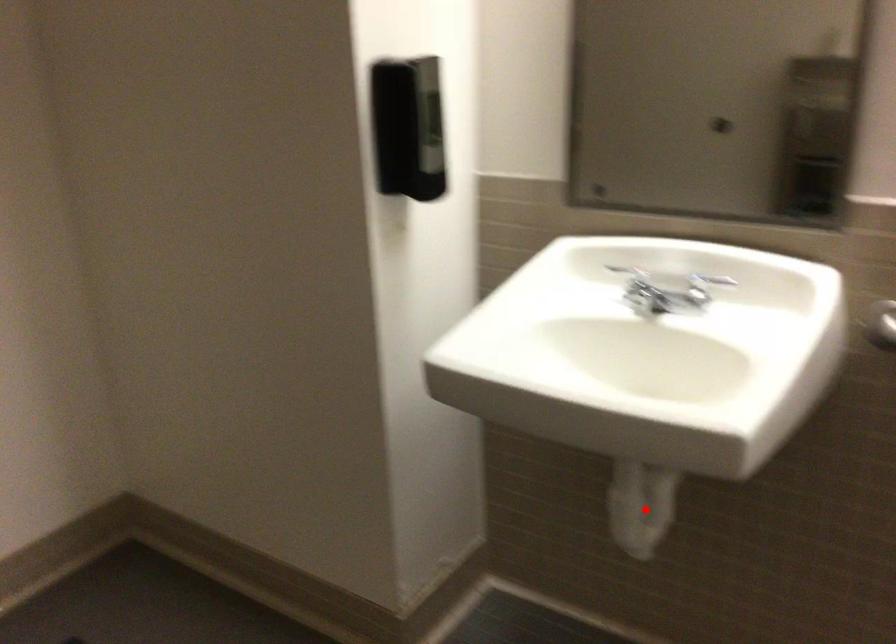
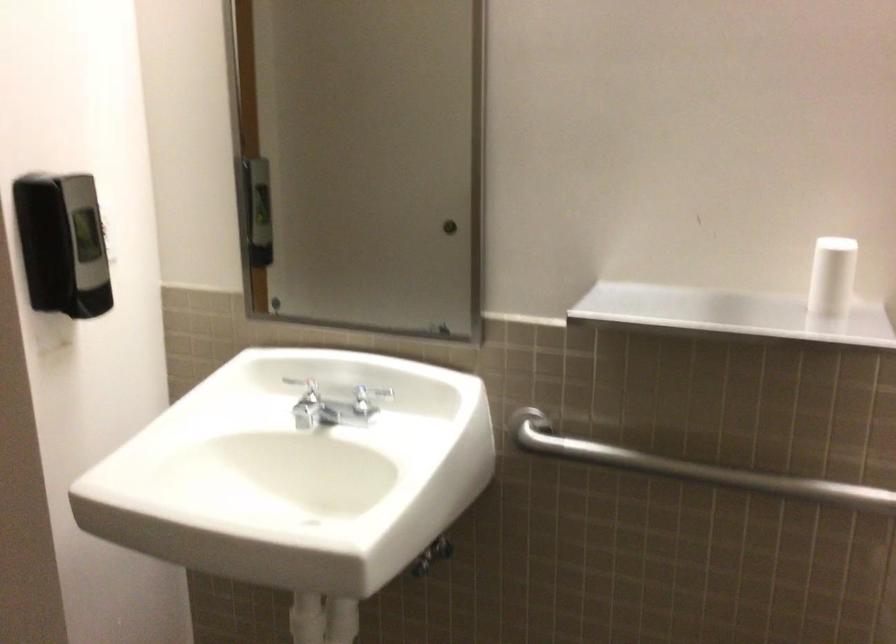
In the second image, find the point that corresponds to the highlighted location in the first image.

(325, 623)